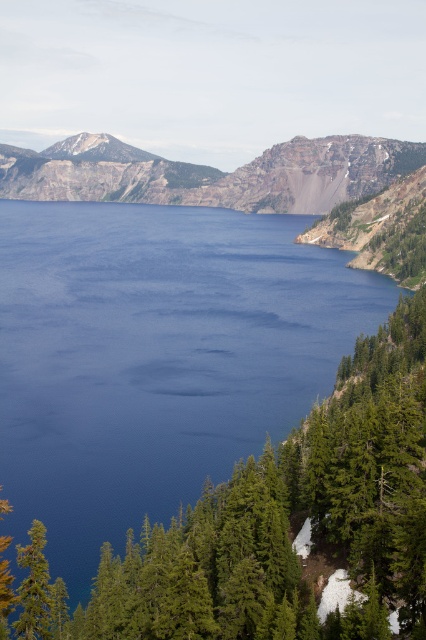
Looking at this image, you are standing at the point labeled as point (x=155, y=356) in the image. What is the closest object to you in the scene?

The deep blue water at center is located at point (x=155, y=356), so you are standing in the deep blue water at center.

You are standing on a path overlooking the deep blue water at center and the rugged brown rock at center. Which object is closer to you?

The deep blue water at center is closer to you because it is in front of the rugged brown rock at center.

You are a hiker who wants to cross the lake to reach the mountains on the other side. The deep blue water at center and rugged brown rock at center are in your path. Which one should you avoid stepping on to ensure safety?

You should avoid stepping on the rugged brown rock at center because the deep blue water at center occupies less space than the rugged brown rock at center, meaning the rock is larger and more stable. However, since the lake is deep and the rock is in the center, it might be submerged. Wait, the description says the water is at center and the rock is also at center. Maybe the rock is in the water? Hmm, the scene mentions the lake has a calm surface with rugged brown rock at center. So the rock is part of or